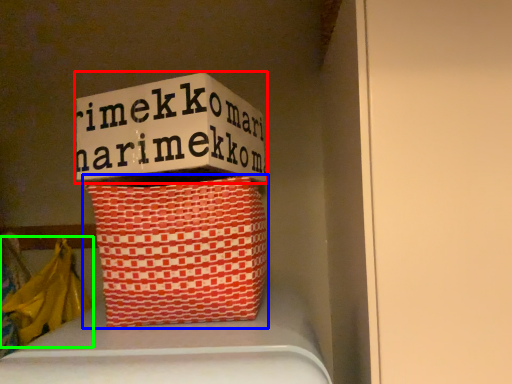
Question: Which object is the closest to the box (highlighted by a red box)? Choose among these: basket (highlighted by a blue box) or material (highlighted by a green box).

Choices:
 (A) basket
 (B) material

Answer: (A)